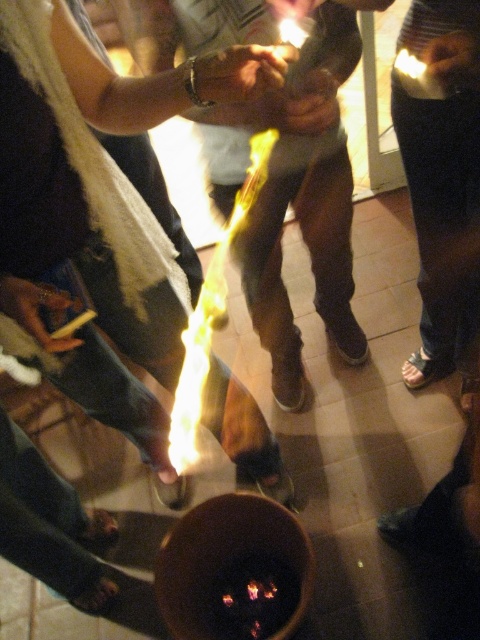
You are a photographer trying to capture the fire at the center of the gathering. You notice two people near the fire. One has matte brown skin at center and another has a matte black hand at center. From your vantage point, which person is closer to the camera?

The matte brown skin at center is closer to the camera because the matte black hand at center is behind it.

You are at a social gathering where there is a fire on the floor. You notice a point marked at coordinates (x=304, y=106). What color is the skin at that point?

The skin at point (x=304, y=106) is matte brown.